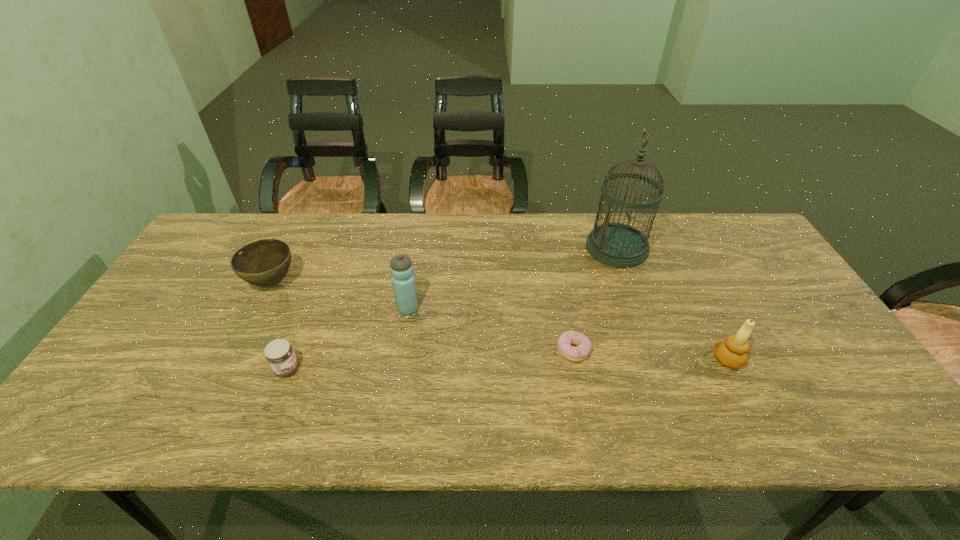
This screenshot has height=540, width=960. In order to click on the third object from right to left in this screenshot , I will do `click(579, 353)`.

Where is `the shortest object`? Image resolution: width=960 pixels, height=540 pixels. the shortest object is located at coordinates (579, 353).

You are a GUI agent. You are given a task and a screenshot of the screen. Output one action in this format:
    pyautogui.click(x=<x>, y=<y>)
    Task: Click on the free space located on the front-facing side of the tallest object
    
    Given the screenshot: What is the action you would take?
    pyautogui.click(x=473, y=248)

Where is `vacant space located on the front-facing side of the tallest object`? Image resolution: width=960 pixels, height=540 pixels. vacant space located on the front-facing side of the tallest object is located at coordinates tap(483, 248).

Identify the location of free space located 0.240m on the front-facing side of the tallest object. (512, 248).

At what (x,y) coordinates should I click in order to perform the action: click on free location located 0.330m on the right of the water bottle. Please return your answer as a coordinate pair (x, y). The height and width of the screenshot is (540, 960). Looking at the image, I should click on (539, 308).

Where is `vacant space situated 0.240m on the left of the fourth shortest object`? This screenshot has height=540, width=960. vacant space situated 0.240m on the left of the fourth shortest object is located at coordinates (614, 360).

Where is `vacant space located 0.240m on the back of the leftmost object`? vacant space located 0.240m on the back of the leftmost object is located at coordinates (303, 220).

I want to click on blank area located on the front label of the jam, so click(370, 369).

This screenshot has height=540, width=960. I want to click on vacant space located 0.110m on the left of the third object from right to left, so click(x=513, y=351).